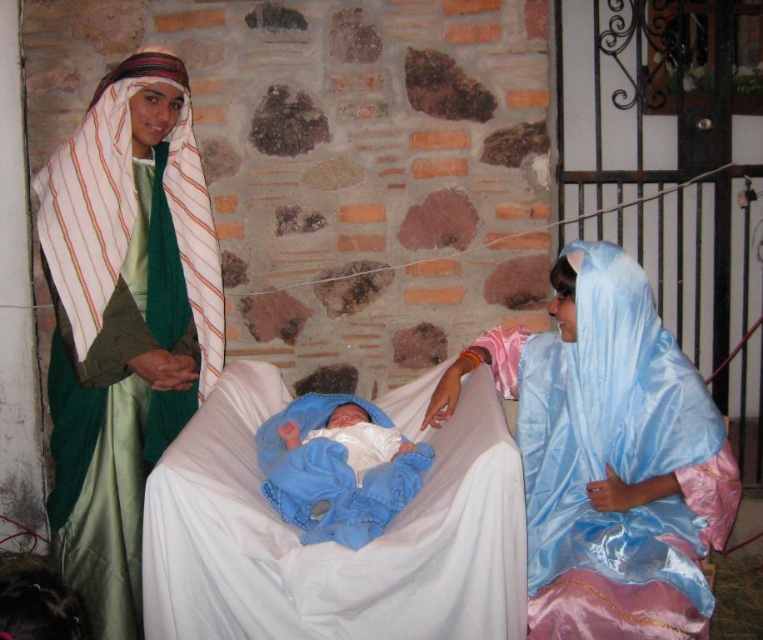
You are an interior designer tasked with arranging items in this nativity scene. You notice the satin blue fabric at right and the white satin infant bed at center. Which object is taller?

The satin blue fabric at right is taller than the white satin infant bed at center.